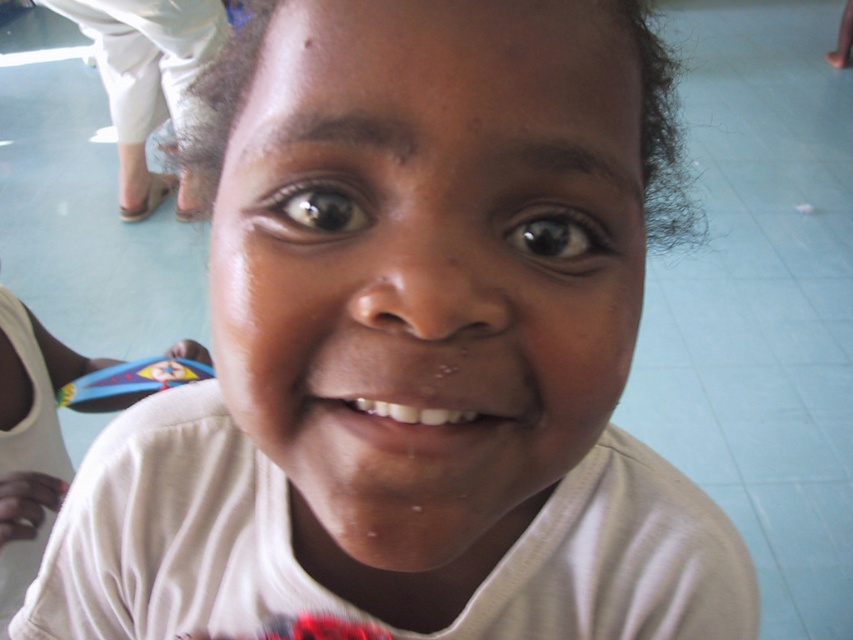
Does white cotton pants at upper left have a larger size compared to black glossy eye at center?

Correct, white cotton pants at upper left is larger in size than black glossy eye at center.

Who is lower down, white cotton pants at upper left or black glossy eye at center?

black glossy eye at center is below.

Does point (157, 202) come farther from viewer compared to point (552, 214)?

Yes, point (157, 202) is farther from viewer.

The image size is (853, 640). I want to click on white cotton pants at upper left, so click(148, 83).

Can you confirm if smooth skin face at center is wider than white cotton pants at upper left?

Incorrect, smooth skin face at center's width does not surpass white cotton pants at upper left's.

Image resolution: width=853 pixels, height=640 pixels. What are the coordinates of `smooth skin face at center` in the screenshot? It's located at (428, 268).

In order to click on smooth skin face at center in this screenshot , I will do `click(428, 268)`.

Based on the photo, does brown glossy eye at upper center appear on the left side of black glossy eye at center?

Correct, you'll find brown glossy eye at upper center to the left of black glossy eye at center.

Can you confirm if brown glossy eye at upper center is shorter than black glossy eye at center?

Yes.

Identify the location of brown glossy eye at upper center. This screenshot has height=640, width=853. (311, 209).